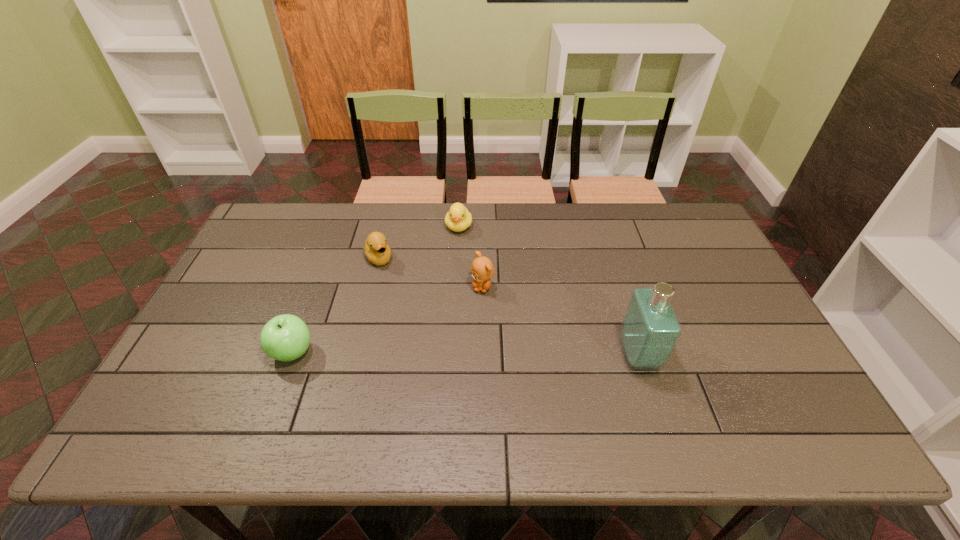
Identify the location of vacant space that satisfies the following two spatial constraints: 1. on the front side of the second object from left to right; 2. on the left side of the third nearest object. (372, 287).

Image resolution: width=960 pixels, height=540 pixels. What are the coordinates of `free region that satisfies the following two spatial constraints: 1. on the front side of the nearer duckling; 2. on the front label of the tallest object` in the screenshot? It's located at (354, 355).

You are a GUI agent. You are given a task and a screenshot of the screen. Output one action in this format:
    pyautogui.click(x=<x>, y=<y>)
    Task: Click on the free location that satisfies the following two spatial constraints: 1. on the front side of the leftmost object; 2. on the front label of the tallest object
    
    Given the screenshot: What is the action you would take?
    pyautogui.click(x=291, y=355)